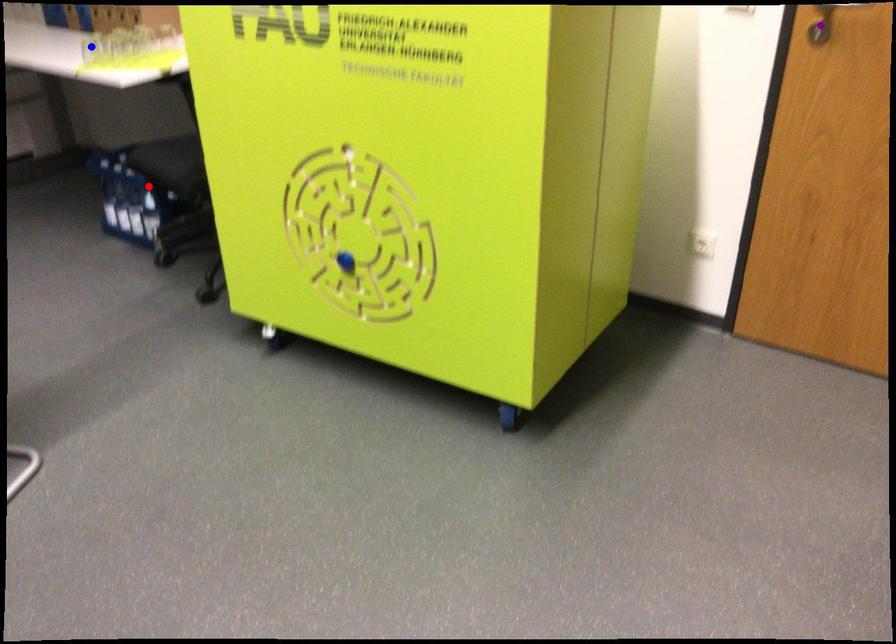
Order these from farthest to nearest:
A) red point
B) purple point
C) blue point

blue point → red point → purple point